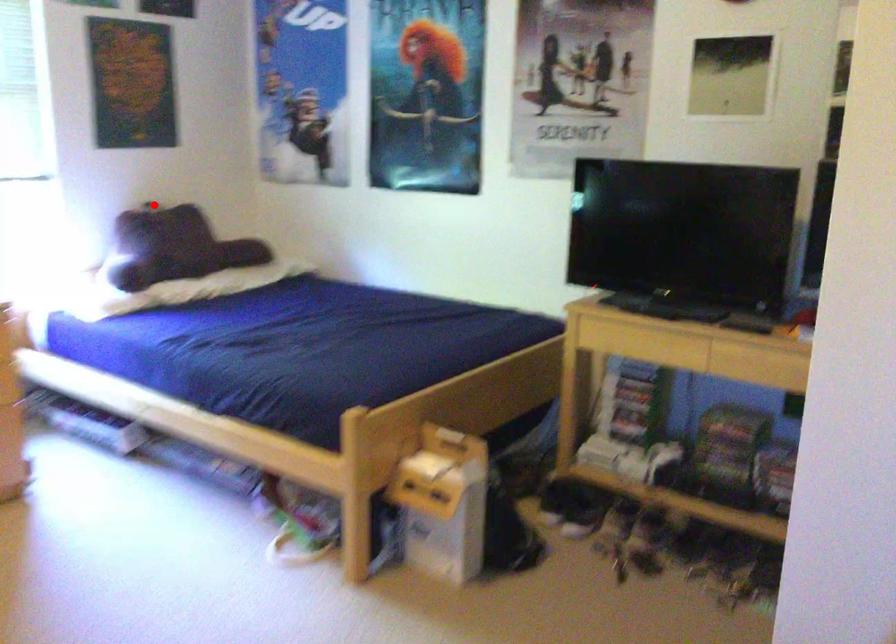
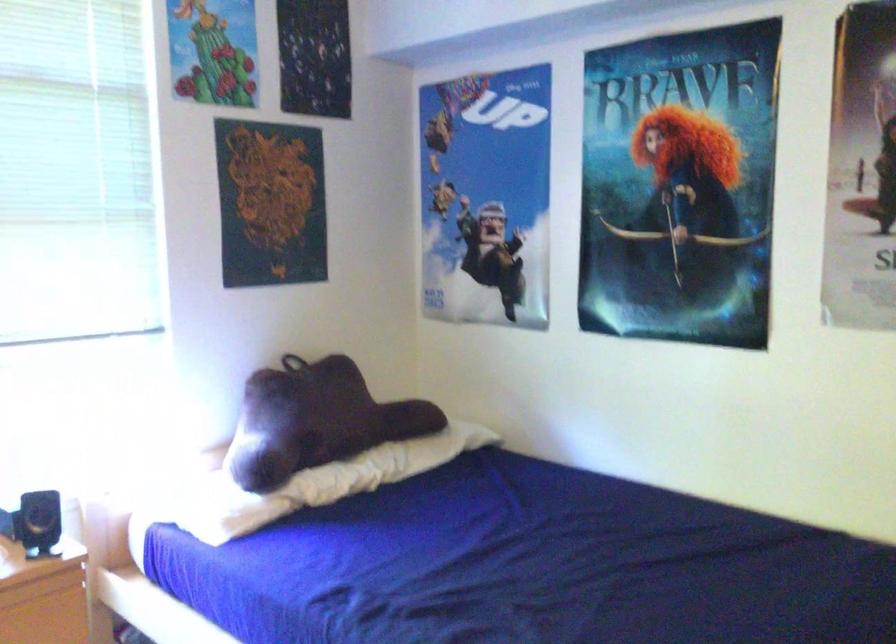
In the second image, find the point that corresponds to the highlighted location in the first image.

(291, 363)